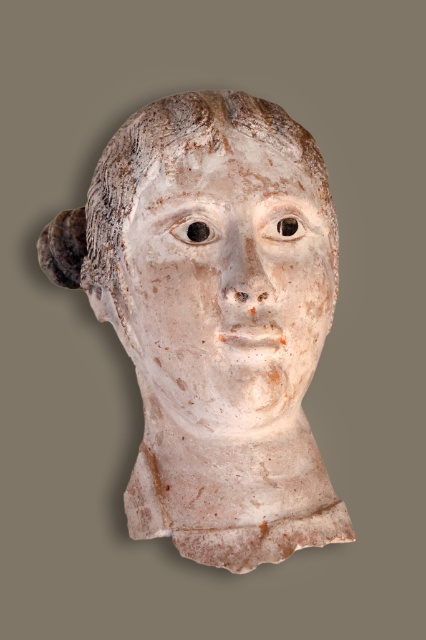
Question: Does white marble bust at center have a lesser width compared to white clay face at center?

Choices:
 (A) yes
 (B) no

Answer: (B)

Question: Can you confirm if white marble bust at center is positioned to the left of white clay face at center?

Choices:
 (A) yes
 (B) no

Answer: (A)

Question: Is white marble bust at center bigger than white clay face at center?

Choices:
 (A) yes
 (B) no

Answer: (A)

Question: Which point appears closest to the camera in this image?

Choices:
 (A) (293, 225)
 (B) (227, 177)

Answer: (B)

Question: Among these objects, which one is farthest from the camera?

Choices:
 (A) white clay face at center
 (B) white marble bust at center

Answer: (B)